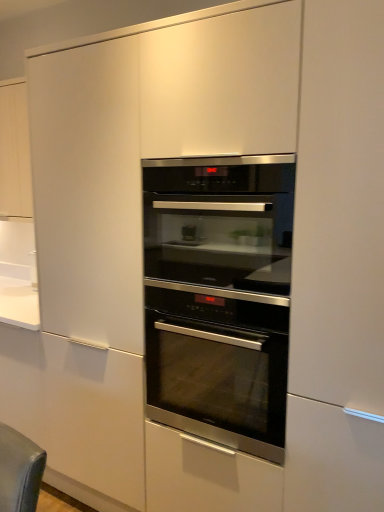
Question: Is stainless steel oven at center, which ranks as the first oven in bottom-to-top order, at the back of stainless steel oven at center, positioned as the 2th oven in bottom-to-top order?

Choices:
 (A) no
 (B) yes

Answer: (A)

Question: Considering the relative positions of stainless steel oven at center, which is counted as the 1th oven, starting from the top, and stainless steel oven at center, which ranks as the first oven in bottom-to-top order, in the image provided, is stainless steel oven at center, which is counted as the 1th oven, starting from the top, to the right of stainless steel oven at center, which ranks as the first oven in bottom-to-top order, from the viewer's perspective?

Choices:
 (A) yes
 (B) no

Answer: (A)

Question: From the image's perspective, does stainless steel oven at center, positioned as the 2th oven in bottom-to-top order, appear higher than stainless steel oven at center, which ranks as the first oven in bottom-to-top order?

Choices:
 (A) no
 (B) yes

Answer: (B)

Question: Is stainless steel oven at center, which is counted as the 1th oven, starting from the top, located outside stainless steel oven at center, which ranks as the first oven in bottom-to-top order?

Choices:
 (A) yes
 (B) no

Answer: (A)

Question: Can you confirm if stainless steel oven at center, positioned as the 2th oven in bottom-to-top order, is thinner than stainless steel oven at center, which ranks as the first oven in bottom-to-top order?

Choices:
 (A) no
 (B) yes

Answer: (B)

Question: Can you confirm if stainless steel oven at center, positioned as the 2th oven in bottom-to-top order, is shorter than stainless steel oven at center, marked as the 2th oven in a top-to-bottom arrangement?

Choices:
 (A) no
 (B) yes

Answer: (B)

Question: From a real-world perspective, is stainless steel oven at center, marked as the 2th oven in a top-to-bottom arrangement, positioned over stainless steel oven at center, which is counted as the 1th oven, starting from the top, based on gravity?

Choices:
 (A) no
 (B) yes

Answer: (A)

Question: Can you confirm if stainless steel oven at center, which ranks as the first oven in bottom-to-top order, is positioned to the left of stainless steel oven at center, which is counted as the 1th oven, starting from the top?

Choices:
 (A) no
 (B) yes

Answer: (B)

Question: Is stainless steel oven at center, which ranks as the first oven in bottom-to-top order, turned away from stainless steel oven at center, positioned as the 2th oven in bottom-to-top order?

Choices:
 (A) no
 (B) yes

Answer: (A)

Question: Is stainless steel oven at center, which ranks as the first oven in bottom-to-top order, bigger than stainless steel oven at center, positioned as the 2th oven in bottom-to-top order?

Choices:
 (A) no
 (B) yes

Answer: (B)

Question: Considering the relative sizes of stainless steel oven at center, which ranks as the first oven in bottom-to-top order, and stainless steel oven at center, positioned as the 2th oven in bottom-to-top order, in the image provided, is stainless steel oven at center, which ranks as the first oven in bottom-to-top order, smaller than stainless steel oven at center, positioned as the 2th oven in bottom-to-top order,?

Choices:
 (A) yes
 (B) no

Answer: (B)

Question: From the image's perspective, does stainless steel oven at center, which ranks as the first oven in bottom-to-top order, appear lower than stainless steel oven at center, which is counted as the 1th oven, starting from the top?

Choices:
 (A) no
 (B) yes

Answer: (B)

Question: Is stainless steel oven at center, which ranks as the first oven in bottom-to-top order, inside or outside of stainless steel oven at center, positioned as the 2th oven in bottom-to-top order?

Choices:
 (A) inside
 (B) outside

Answer: (B)